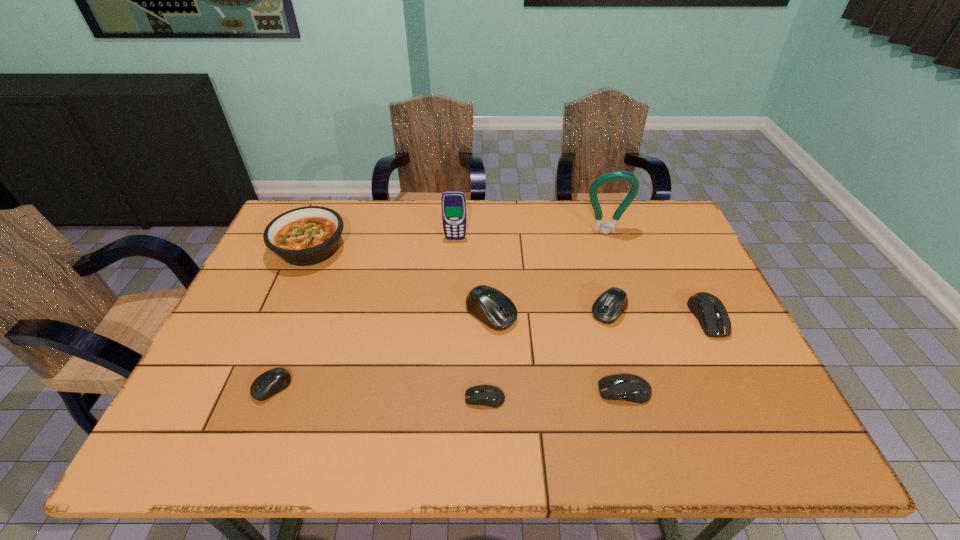
The width and height of the screenshot is (960, 540). What are the coordinates of `bottle opener` in the screenshot? It's located at (599, 226).

Locate an element on the screen. the tallest object is located at coordinates (599, 226).

You are a GUI agent. You are given a task and a screenshot of the screen. Output one action in this format:
    pyautogui.click(x=<x>, y=<y>)
    Task: Click on the second tallest object
    The image size is (960, 540).
    Given the screenshot: What is the action you would take?
    pyautogui.click(x=453, y=203)

Identify the location of the third object from left to right. (453, 203).

Find the location of `stew`. stew is located at coordinates (304, 236).

The height and width of the screenshot is (540, 960). In order to click on the fourth tallest object in this screenshot , I will do `click(490, 306)`.

Locate an element on the screen. This screenshot has width=960, height=540. the second black mouse from left to right is located at coordinates (490, 306).

I want to click on the second smallest black mouse, so click(x=609, y=306).

The width and height of the screenshot is (960, 540). I want to click on the rightmost dark computer equipment, so click(x=709, y=310).

You are a GUI agent. You are given a task and a screenshot of the screen. Output one action in this format:
    pyautogui.click(x=<x>, y=<y>)
    Task: Click on the farthest dark computer equipment
    Image resolution: width=960 pixels, height=540 pixels.
    Given the screenshot: What is the action you would take?
    pyautogui.click(x=709, y=310)